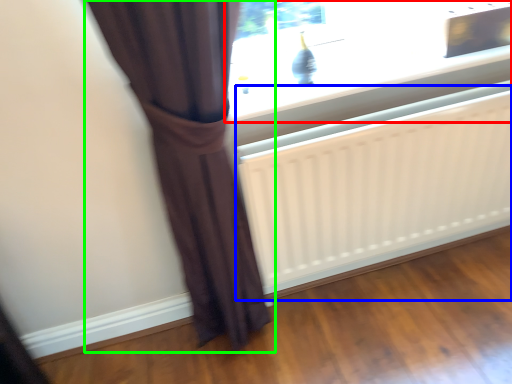
Question: Which is nearer to the window (highlighted by a red box)? radiator (highlighted by a blue box) or curtain (highlighted by a green box).

Choices:
 (A) radiator
 (B) curtain

Answer: (A)